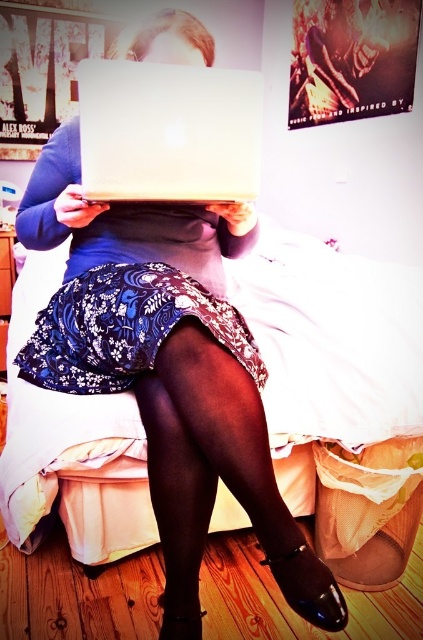
Question: Is black patent leather shoes at lower center wider than white matte laptop at center?

Choices:
 (A) no
 (B) yes

Answer: (B)

Question: Is black patent leather shoes at lower center behind white matte laptop at center?

Choices:
 (A) no
 (B) yes

Answer: (A)

Question: Is black patent leather shoes at lower center wider than white matte laptop at center?

Choices:
 (A) no
 (B) yes

Answer: (B)

Question: Which of the following is the farthest from the observer?

Choices:
 (A) white matte laptop at center
 (B) black patent leather shoes at lower center

Answer: (A)